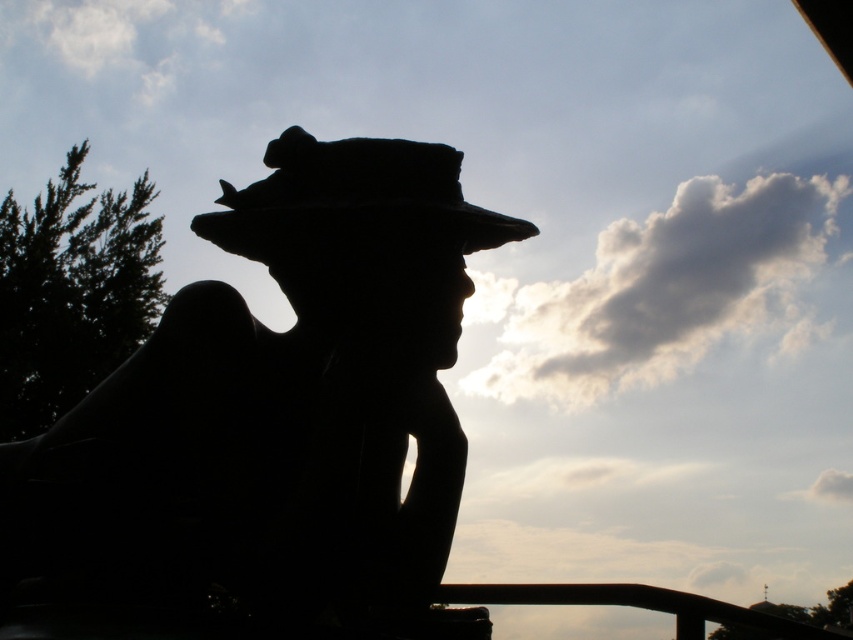
You are standing in front of the black matte statue at center. If you take one step forward, will you be closer than 5 feet to it?

The black matte statue at center is 5.63 feet away from viewer. After taking one step forward, you would be approximately 4.63 feet away, which is closer than 5 feet.

You are an art student trying to sketch the statue and its hat from the image. Since both the black matte statue at center and the silvery metallic fedora at center are in the center, which one should you draw first to ensure proper perspective?

You should draw the black matte statue at center first because it is closer to the viewer than the silvery metallic fedora at center, so it should be sketched before the hat to maintain correct perspective.

You are an artist planning to paint the scene. You need to decide which object to focus on first based on their sizes. According to the description, which object should you paint first, the black matte statue at center or the silvery metallic fedora at center?

The black matte statue at center is bigger than the silvery metallic fedora at center, so you should paint the black matte statue at center first as it is the larger object in the scene.